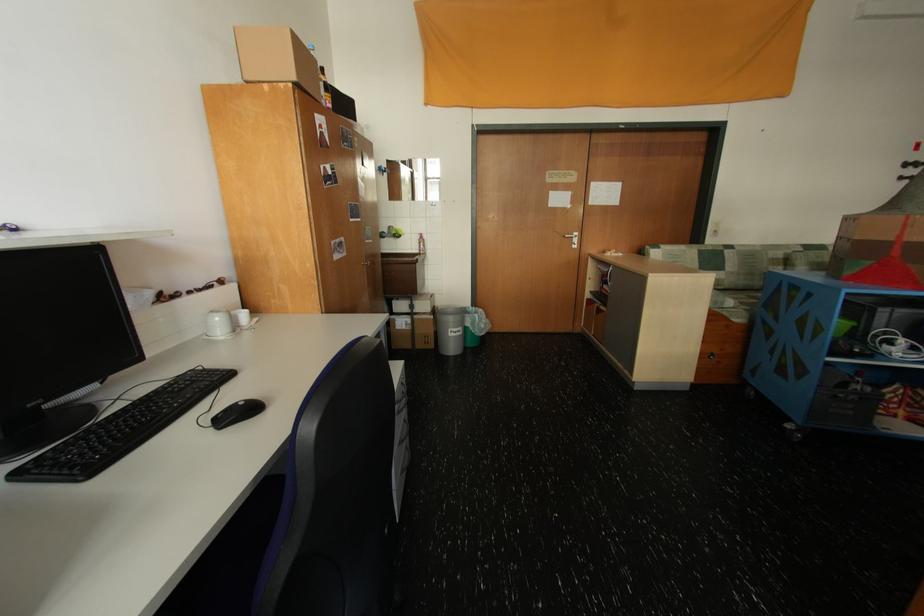
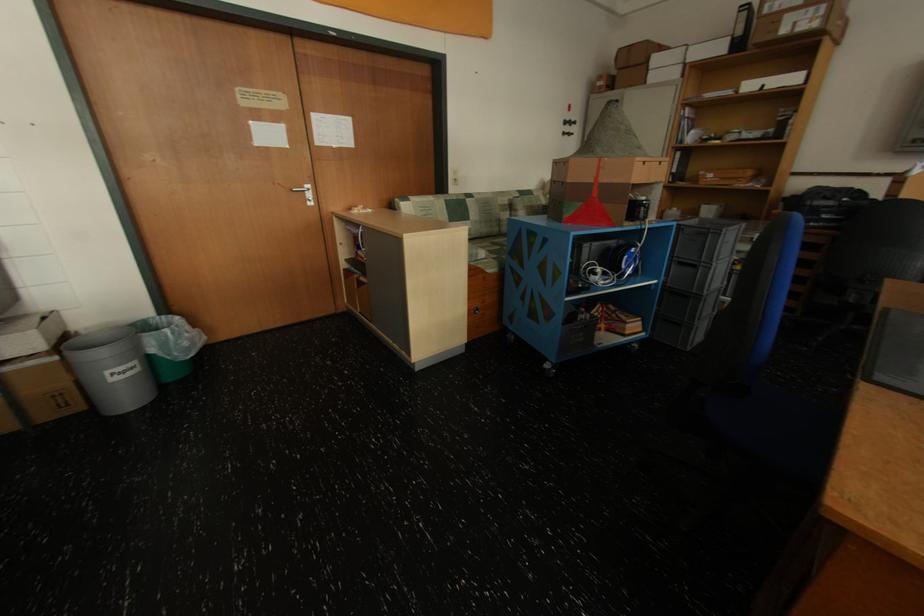
In the second image, find the point that corresponds to (879,264) in the first image.

(589, 206)